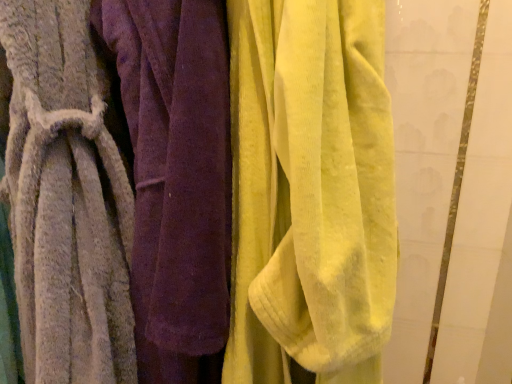
Question: Considering the relative sizes of soft gray towel at left, placed as the 2th towel when sorted from right to left, and velvet yellow towel at center, the 3th towel when ordered from left to right, in the image provided, is soft gray towel at left, placed as the 2th towel when sorted from right to left, taller than velvet yellow towel at center, the 3th towel when ordered from left to right,?

Choices:
 (A) yes
 (B) no

Answer: (A)

Question: Is velvet yellow towel at center, the 3th towel when ordered from left to right, located within soft gray towel at left, which is the second towel in left-to-right order?

Choices:
 (A) yes
 (B) no

Answer: (B)

Question: Is soft gray towel at left, which is the second towel in left-to-right order, not within velvet yellow towel at center, the 3th towel when ordered from left to right?

Choices:
 (A) yes
 (B) no

Answer: (A)

Question: Considering the relative sizes of soft gray towel at left, which is the second towel in left-to-right order, and velvet yellow towel at center, the 3th towel when ordered from left to right, in the image provided, is soft gray towel at left, which is the second towel in left-to-right order, wider than velvet yellow towel at center, the 3th towel when ordered from left to right,?

Choices:
 (A) yes
 (B) no

Answer: (B)

Question: From the image's perspective, would you say soft gray towel at left, which is the second towel in left-to-right order, is shown under velvet yellow towel at center, positioned as the 1th towel in right-to-left order?

Choices:
 (A) yes
 (B) no

Answer: (B)

Question: Is soft gray towel at left, which is the second towel in left-to-right order, behind velvet yellow towel at center, the 3th towel when ordered from left to right?

Choices:
 (A) no
 (B) yes

Answer: (B)

Question: Considering the relative positions of gray textured towel at left, which ranks as the 1th towel in left-to-right order, and velvet yellow towel at center, the 3th towel when ordered from left to right, in the image provided, is gray textured towel at left, which ranks as the 1th towel in left-to-right order, in front of velvet yellow towel at center, the 3th towel when ordered from left to right,?

Choices:
 (A) yes
 (B) no

Answer: (B)

Question: Is the surface of gray textured towel at left, which ranks as the 1th towel in left-to-right order, in direct contact with velvet yellow towel at center, the 3th towel when ordered from left to right?

Choices:
 (A) no
 (B) yes

Answer: (A)

Question: Does gray textured towel at left, which ranks as the 1th towel in left-to-right order, turn towards velvet yellow towel at center, the 3th towel when ordered from left to right?

Choices:
 (A) yes
 (B) no

Answer: (B)

Question: Is gray textured towel at left, which ranks as the 1th towel in left-to-right order, smaller than velvet yellow towel at center, positioned as the 1th towel in right-to-left order?

Choices:
 (A) no
 (B) yes

Answer: (A)

Question: From a real-world perspective, is gray textured towel at left, which ranks as the 1th towel in left-to-right order, physically below velvet yellow towel at center, positioned as the 1th towel in right-to-left order?

Choices:
 (A) yes
 (B) no

Answer: (A)

Question: Is gray textured towel at left, the third towel when ordered from right to left, turned away from velvet yellow towel at center, positioned as the 1th towel in right-to-left order?

Choices:
 (A) yes
 (B) no

Answer: (B)

Question: Could you tell me if velvet yellow towel at center, the 3th towel when ordered from left to right, is facing gray textured towel at left, which ranks as the 1th towel in left-to-right order?

Choices:
 (A) yes
 (B) no

Answer: (B)